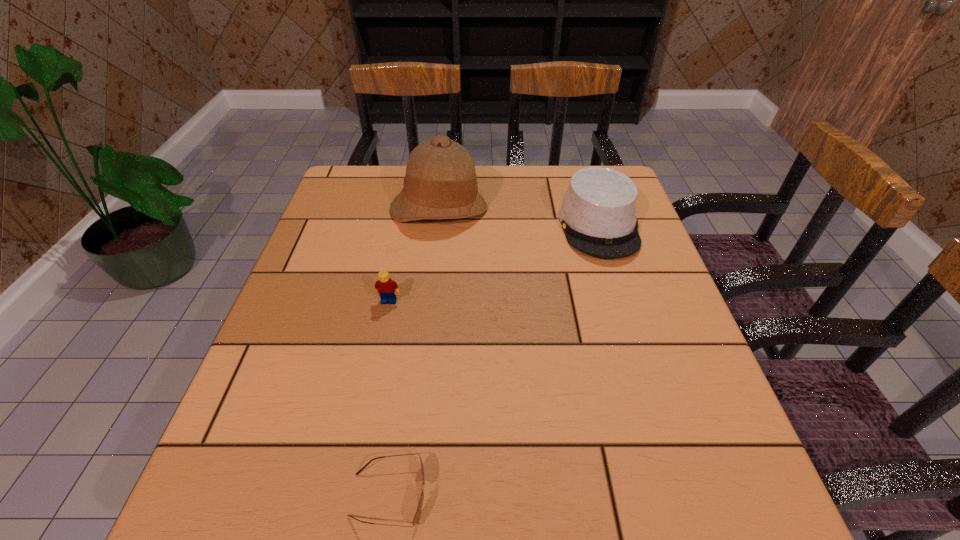
Point out which object is positioned as the second nearest to the third shortest object. Please provide its 2D coordinates. Your answer should be formatted as a tuple, i.e. [(x, y)], where the tuple contains the x and y coordinates of a point satisfying the conditions above.

[(385, 286)]

Locate an element on the screen. The image size is (960, 540). object identified as the second closest to the left hat is located at coordinates (385, 286).

Locate an element on the screen. The width and height of the screenshot is (960, 540). vacant position in the image that satisfies the following two spatial constraints: 1. on the front-facing side of the taller hat; 2. on the front-facing side of the nearest object is located at coordinates (406, 495).

The width and height of the screenshot is (960, 540). Identify the location of vacant area in the image that satisfies the following two spatial constraints: 1. on the front-facing side of the taller hat; 2. on the front-facing side of the shortest object. pos(406,495).